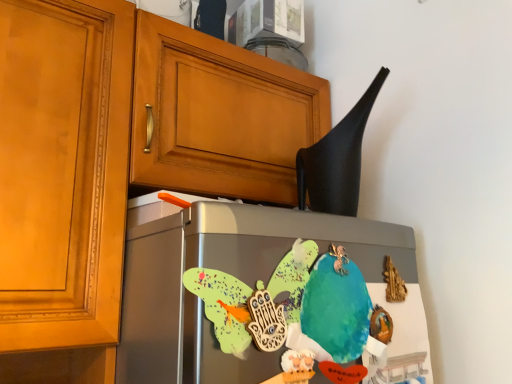
Question: Considering the positions of matte wood cabinet at upper left and watercolor paper parrot at center in the image, is matte wood cabinet at upper left bigger or smaller than watercolor paper parrot at center?

Choices:
 (A) big
 (B) small

Answer: (A)

Question: In the image, is matte wood cabinet at upper left positioned in front of or behind watercolor paper parrot at center?

Choices:
 (A) front
 (B) behind

Answer: (A)

Question: Which object is positioned farthest from the black matte exhaust hood at upper right?

Choices:
 (A) satin silver fridge at center
 (B) matte wood cabinet at upper left
 (C) watercolor paper parrot at center

Answer: (B)

Question: Which object is positioned farthest from the black matte exhaust hood at upper right?

Choices:
 (A) matte wood cabinet at upper left
 (B) satin silver fridge at center
 (C) watercolor paper parrot at center

Answer: (A)